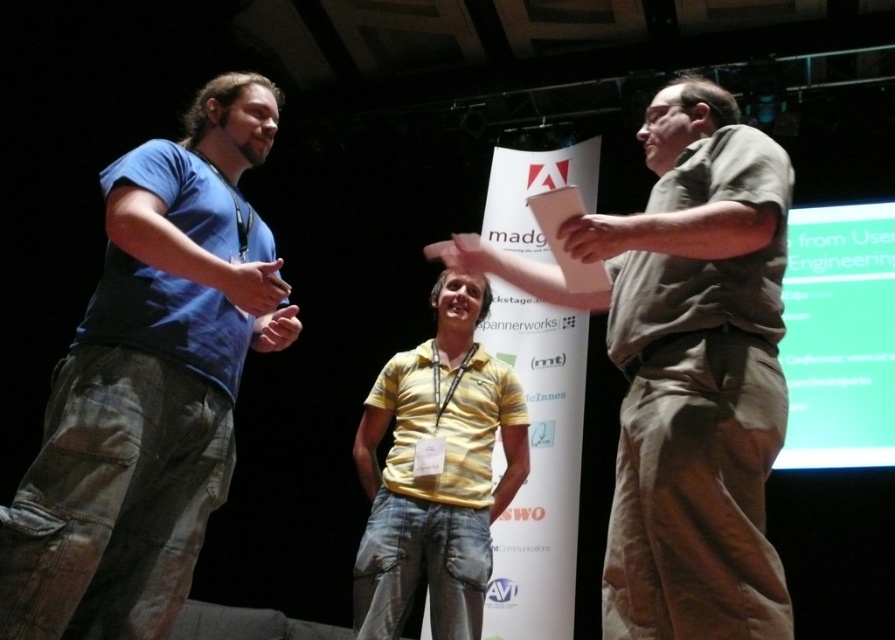
Can you confirm if blue cotton shirt at left is taller than matte brown shirt at center?

Indeed, blue cotton shirt at left has a greater height compared to matte brown shirt at center.

Which of these two, blue cotton shirt at left or matte brown shirt at center, stands shorter?

Standing shorter between the two is matte brown shirt at center.

The width and height of the screenshot is (895, 640). Describe the element at coordinates (149, 384) in the screenshot. I see `blue cotton shirt at left` at that location.

Locate an element on the screen. This screenshot has height=640, width=895. blue cotton shirt at left is located at coordinates (149, 384).

Between blue cotton shirt at left and yellow matte shirt at center, which one is positioned higher?

blue cotton shirt at left

Is point (121, 410) positioned before point (376, 524)?

Yes, point (121, 410) is in front of point (376, 524).

Where is `blue cotton shirt at left`? This screenshot has height=640, width=895. blue cotton shirt at left is located at coordinates (149, 384).

Can you confirm if matte brown shirt at center is shorter than yellow matte shirt at center?

Indeed, matte brown shirt at center has a lesser height compared to yellow matte shirt at center.

Is matte brown shirt at center to the left of yellow matte shirt at center from the viewer's perspective?

In fact, matte brown shirt at center is to the right of yellow matte shirt at center.

Is point (739, 356) positioned in front of point (374, 596)?

Yes, point (739, 356) is in front of point (374, 596).

The width and height of the screenshot is (895, 640). I want to click on matte brown shirt at center, so click(686, 369).